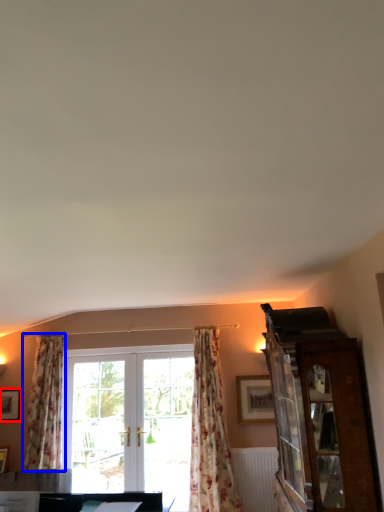
Question: Which object appears farthest to the camera in this image, picture frame (highlighted by a red box) or curtain (highlighted by a blue box)?

Choices:
 (A) picture frame
 (B) curtain

Answer: (A)